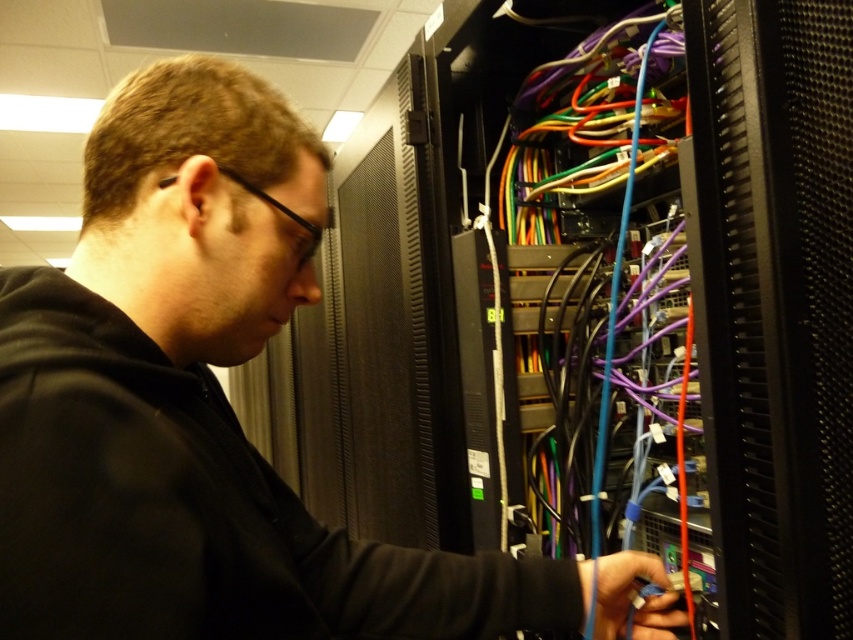
Is black matte jacket at center in front of black textured server at center?

Yes, it is.

Between point (45, 636) and point (846, 228), which one is positioned in front?

Positioned in front is point (45, 636).

Is point (97, 204) behind point (773, 492)?

No, (97, 204) is closer to viewer.

This screenshot has height=640, width=853. Identify the location of black matte jacket at center. (212, 410).